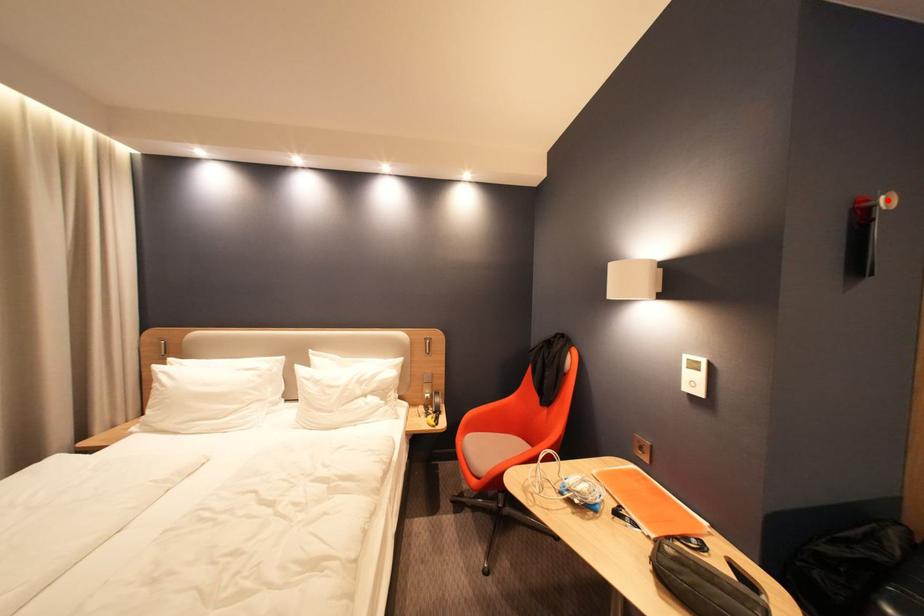
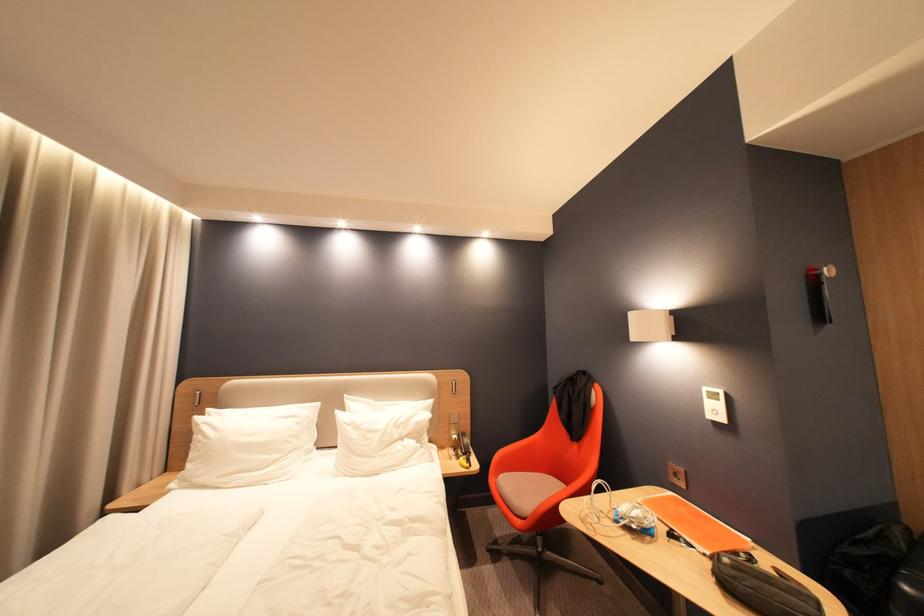
The point at the highlighted location is marked in the first image. Where is the corresponding point in the second image?

(830, 270)